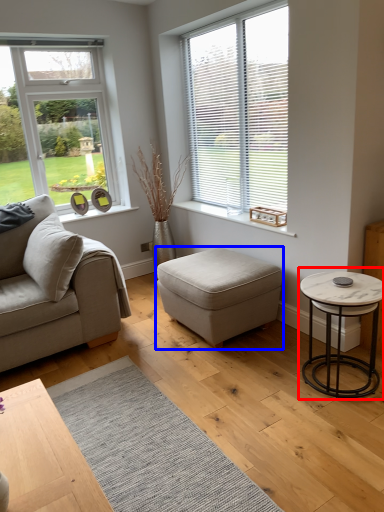
Question: Which object is further to the camera taking this photo, coffee table (highlighted by a red box) or stool (highlighted by a blue box)?

Choices:
 (A) coffee table
 (B) stool

Answer: (B)